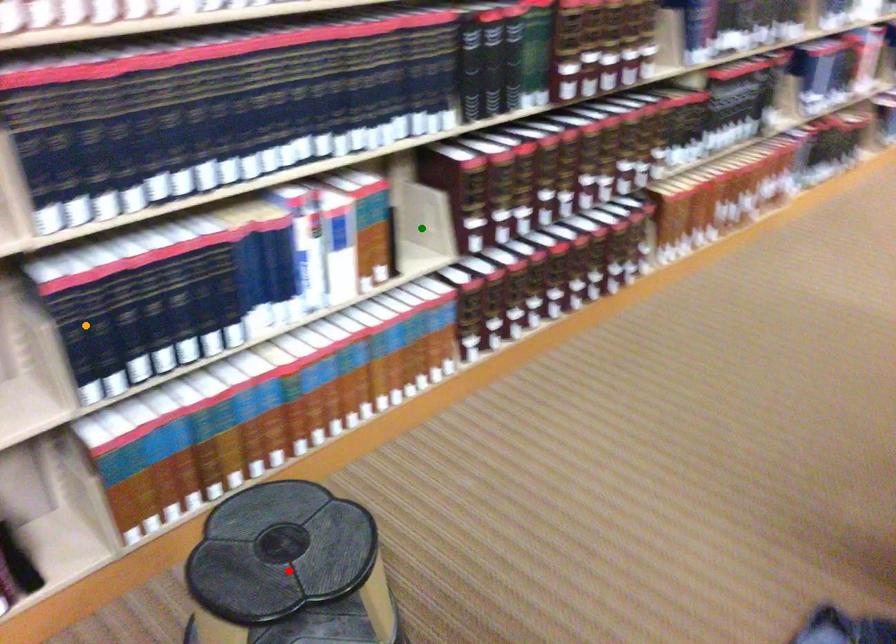
Order these from nearest to farthest:
green point
orange point
red point

red point
orange point
green point